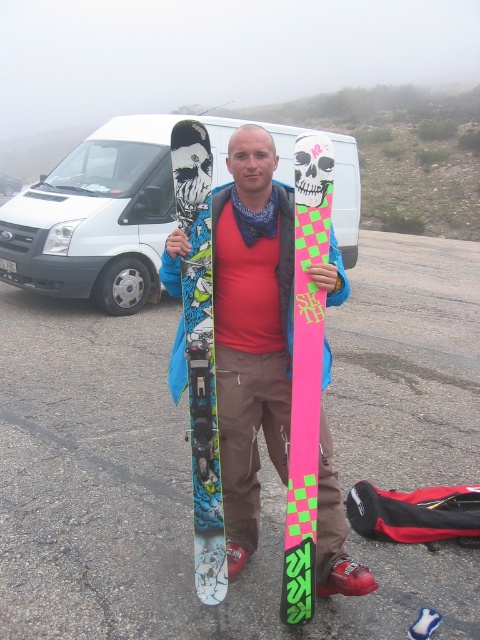
You are a photographer trying to capture the white matte van at upper left and the matte plastic skis at center in the same frame. Based on their positions, which object should you focus on first to ensure both are in the shot?

The matte plastic skis at center is located below the white matte van at upper left, so you should focus on the white matte van at upper left first to ensure both are in the shot.

You are a photographer trying to capture the matte plastic skis at center and the white matte van at upper left in a single shot. Based on their positions, which object will appear larger in the photo?

The matte plastic skis at center will appear larger in the photo because they are closer to the viewer than the white matte van at upper left.